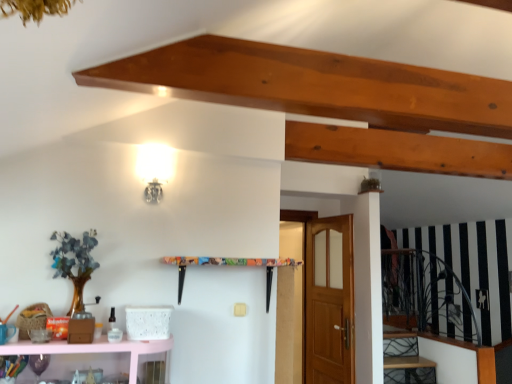
Question: Is the depth of wooden door at center greater than that of pink glossy shelf at lower left?

Choices:
 (A) yes
 (B) no

Answer: (A)

Question: Could you tell me if wooden door at center is facing pink glossy shelf at lower left?

Choices:
 (A) yes
 (B) no

Answer: (B)

Question: Are wooden door at center and pink glossy shelf at lower left making contact?

Choices:
 (A) no
 (B) yes

Answer: (A)

Question: From a real-world perspective, is wooden door at center below pink glossy shelf at lower left?

Choices:
 (A) yes
 (B) no

Answer: (B)

Question: Is wooden door at center positioned before pink glossy shelf at lower left?

Choices:
 (A) yes
 (B) no

Answer: (B)

Question: Considering the relative sizes of wooden door at center and pink glossy shelf at lower left in the image provided, is wooden door at center wider than pink glossy shelf at lower left?

Choices:
 (A) no
 (B) yes

Answer: (A)

Question: Is wooden stairwell at lower right positioned with its back to pink glossy shelf at lower left?

Choices:
 (A) yes
 (B) no

Answer: (B)

Question: Can you confirm if wooden stairwell at lower right is wider than pink glossy shelf at lower left?

Choices:
 (A) yes
 (B) no

Answer: (A)

Question: Does wooden stairwell at lower right lie behind pink glossy shelf at lower left?

Choices:
 (A) yes
 (B) no

Answer: (A)

Question: Considering the relative sizes of wooden stairwell at lower right and pink glossy shelf at lower left in the image provided, is wooden stairwell at lower right thinner than pink glossy shelf at lower left?

Choices:
 (A) no
 (B) yes

Answer: (A)

Question: From the image's perspective, is wooden stairwell at lower right above pink glossy shelf at lower left?

Choices:
 (A) yes
 (B) no

Answer: (B)

Question: Is wooden stairwell at lower right at the right side of pink glossy shelf at lower left?

Choices:
 (A) no
 (B) yes

Answer: (B)

Question: Is pink glossy shelf at lower left aimed at wooden stairwell at lower right?

Choices:
 (A) yes
 (B) no

Answer: (B)